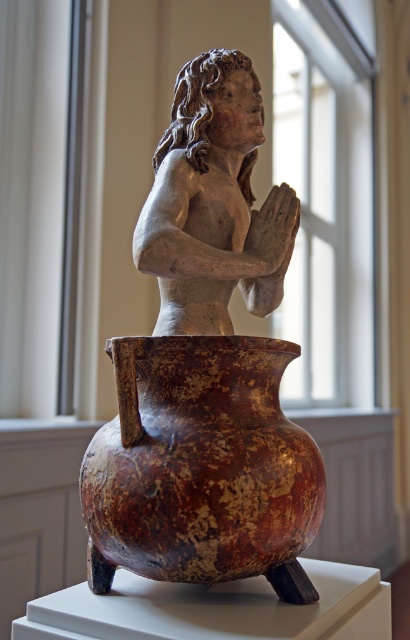
You are an art conservator examining the sculpture. You notice a point at coordinates (205, 368). Based on the description, what object does this point belong to?

The point at coordinates (205, 368) belongs to the matte clay figure at center.

Consider the image. You are a museum curator planning to install a protective glass barrier around the matte clay figure at center and the matte gray statue at center. The barrier must be at least 5 centimeters wide to allow visitors to view both objects comfortably. Based on the current spacing between them, will the barrier fit properly?

The matte clay figure at center is only 4.99 centimeters away from the matte gray statue at center, which is less than the required 5 centimeters. Therefore, the protective glass barrier will not fit properly as there isn